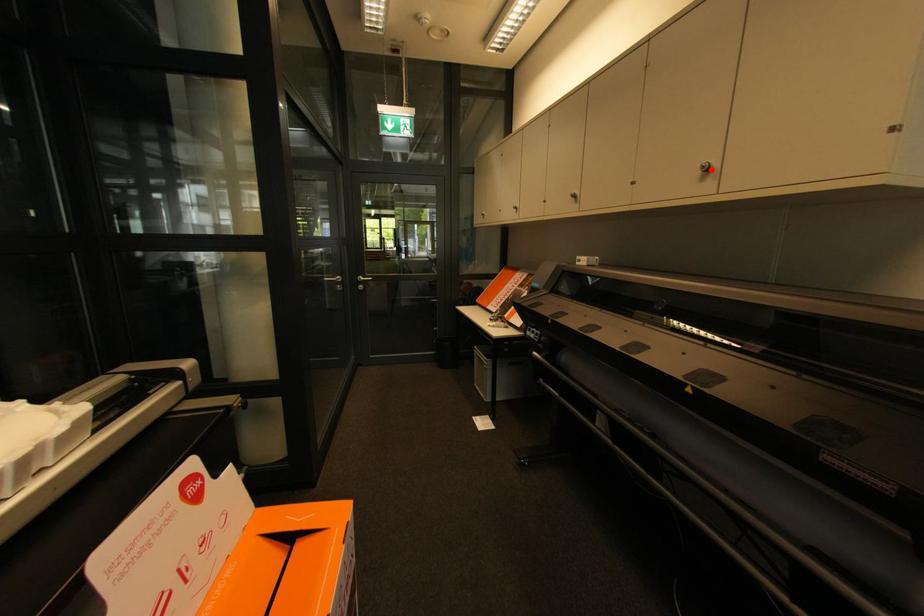
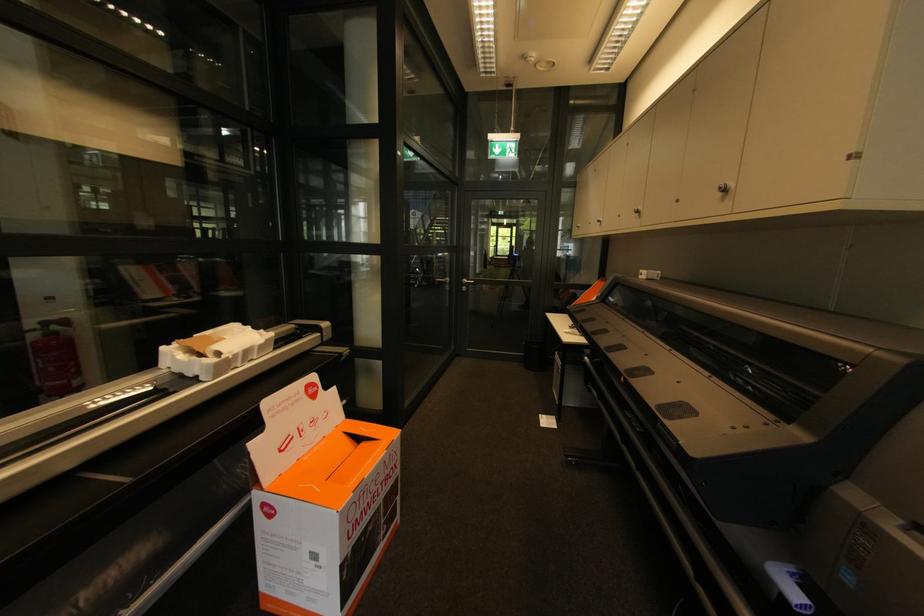
The point at the highlighted location is marked in the first image. Where is the corresponding point in the second image?

(727, 191)